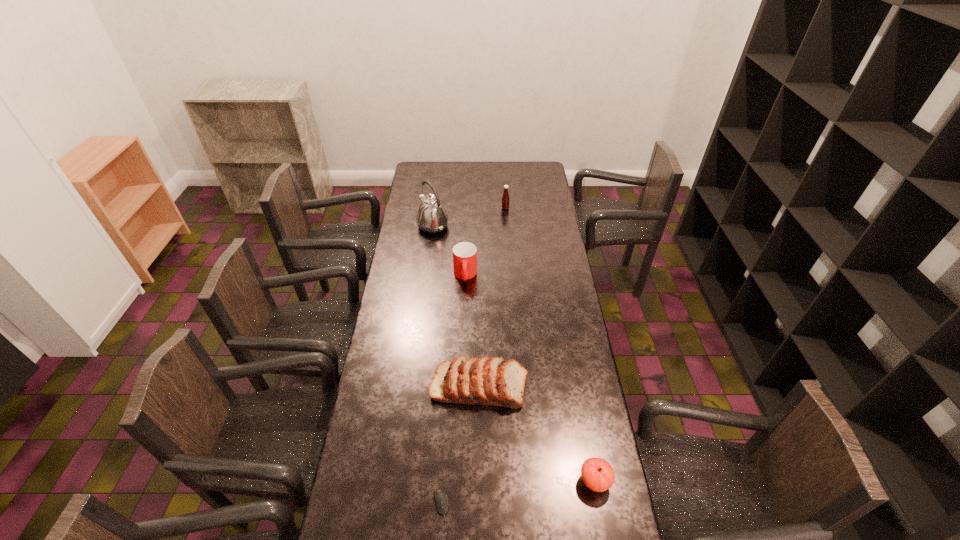
This screenshot has height=540, width=960. Identify the location of the second farthest object. (432, 217).

This screenshot has height=540, width=960. Identify the location of the tallest object. (432, 217).

Find the location of a particular element. Tabasco sauce is located at coordinates (505, 198).

Identify the location of the third farthest object. (464, 254).

You are a GUI agent. You are given a task and a screenshot of the screen. Output one action in this format:
    pyautogui.click(x=<x>, y=<y>)
    Task: Click on the third nearest object
    Image resolution: width=960 pixels, height=540 pixels.
    Given the screenshot: What is the action you would take?
    pyautogui.click(x=487, y=381)

The image size is (960, 540). In order to click on apple in this screenshot , I will do `click(597, 474)`.

Locate an element on the screen. the shortest object is located at coordinates click(x=440, y=496).

This screenshot has height=540, width=960. Find the location of `vacant area situated on the back of the tallest object`. vacant area situated on the back of the tallest object is located at coordinates (439, 181).

Where is `blank space located 0.150m on the right of the farthest object`? blank space located 0.150m on the right of the farthest object is located at coordinates (538, 208).

At what (x,y) coordinates should I click in order to perform the action: click on vacant space situated on the side of the third farthest object with the handle. Please return your answer as a coordinate pair (x, y). The height and width of the screenshot is (540, 960). Looking at the image, I should click on (465, 299).